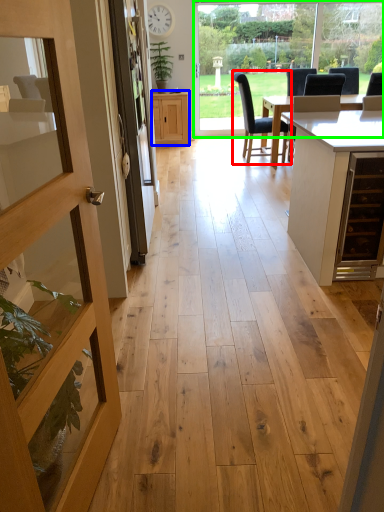
Question: Considering the real-world distances, which object is farthest from chair (highlighted by a red box)? cabinetry (highlighted by a blue box) or window frame (highlighted by a green box)?

Choices:
 (A) cabinetry
 (B) window frame

Answer: (B)